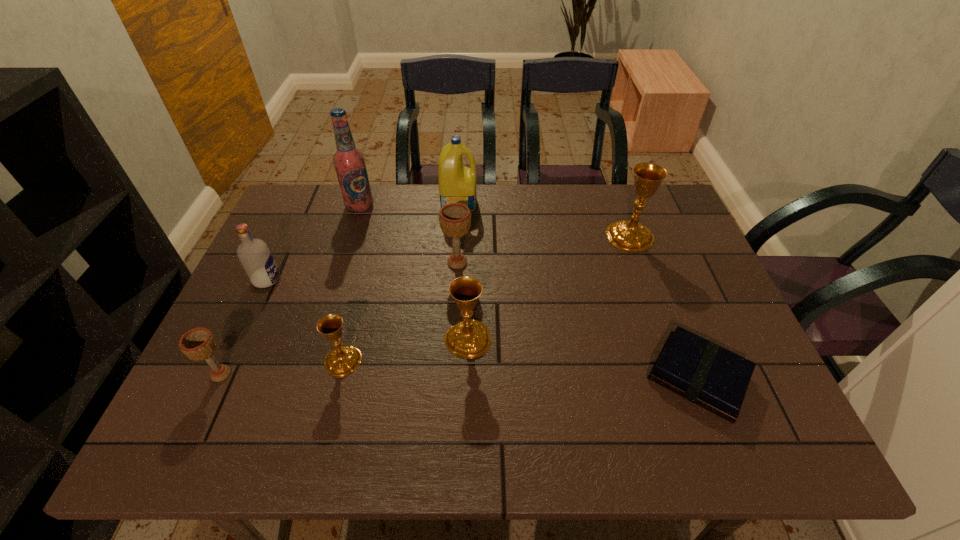
Find the location of `free region located on the right of the bigger beige chalice`. free region located on the right of the bigger beige chalice is located at coordinates (550, 262).

Find the location of a particular element. The width and height of the screenshot is (960, 540). free space located on the back of the nearer beige chalice is located at coordinates (274, 262).

I want to click on vacant position located on the back of the leftmost gold chalice, so pyautogui.click(x=356, y=310).

You are a GUI agent. You are given a task and a screenshot of the screen. Output one action in this format:
    pyautogui.click(x=<x>, y=<y>)
    Task: Click on the vacant area located on the left of the blue book
    Image resolution: width=960 pixels, height=540 pixels.
    Given the screenshot: What is the action you would take?
    pyautogui.click(x=588, y=377)

The image size is (960, 540). Find the location of `alcohol present at the far edge`. alcohol present at the far edge is located at coordinates (349, 162).

This screenshot has height=540, width=960. Identify the location of detergent present at the far edge. [457, 183].

I want to click on chalice at the far edge, so click(628, 235).

Locate an element on the screen. This screenshot has height=540, width=960. object present at the near edge is located at coordinates (701, 371).

At what (x,y) coordinates should I click in order to perform the action: click on vodka that is positioned at the left edge. Please return your answer as a coordinate pair (x, y). The height and width of the screenshot is (540, 960). Looking at the image, I should click on (256, 258).

The height and width of the screenshot is (540, 960). Find the location of `chalice that is at the left edge`. chalice that is at the left edge is located at coordinates (198, 344).